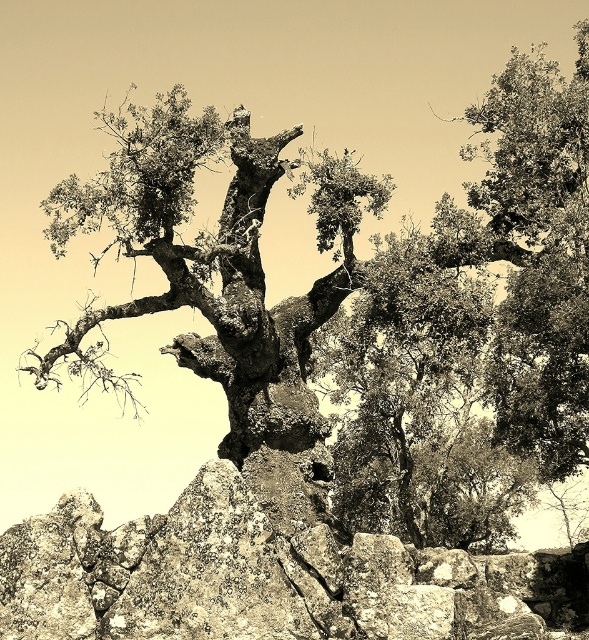
You are a hiker trying to navigate around the rough bark tree trunk at center and the rough textured rock at lower left. Which object is located to the right of the tree trunk?

The rough textured rock at lower left is positioned on the right side of the rough bark tree trunk at center, so it is located to the right of the tree trunk.

You are a geologist examining the image and want to locate the rough textured rock at lower left. According to the coordinates provided, where exactly is it positioned in the image?

The rough textured rock at lower left is located at point coordinates of (266, 576).